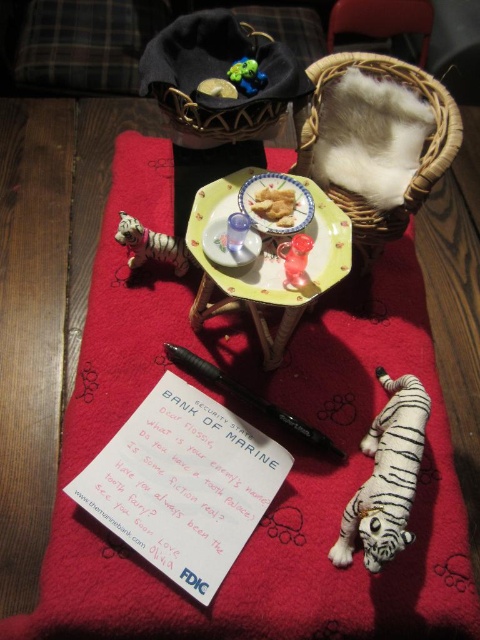
Question: Which point is farther to the camera?

Choices:
 (A) translucent plastic toy at center
 (B) black plastic pen at lower center

Answer: (B)

Question: Is the position of woven wicker basket at upper right less distant than that of white matte tiger at left?

Choices:
 (A) no
 (B) yes

Answer: (B)

Question: Can you confirm if white plush tiger at lower right is bigger than white matte tiger at left?

Choices:
 (A) no
 (B) yes

Answer: (B)

Question: Among these objects, which one is nearest to the camera?

Choices:
 (A) black fabric basket at upper center
 (B) yellow paper plate at center
 (C) translucent plastic toy at center
 (D) porcelain plate at center

Answer: (D)

Question: Can you confirm if white matte tiger at left is positioned below rubberized plastic toy at upper center?

Choices:
 (A) no
 (B) yes

Answer: (B)

Question: Which of the following is the farthest from the observer?

Choices:
 (A) porcelain plate at center
 (B) black fabric basket at upper center

Answer: (B)